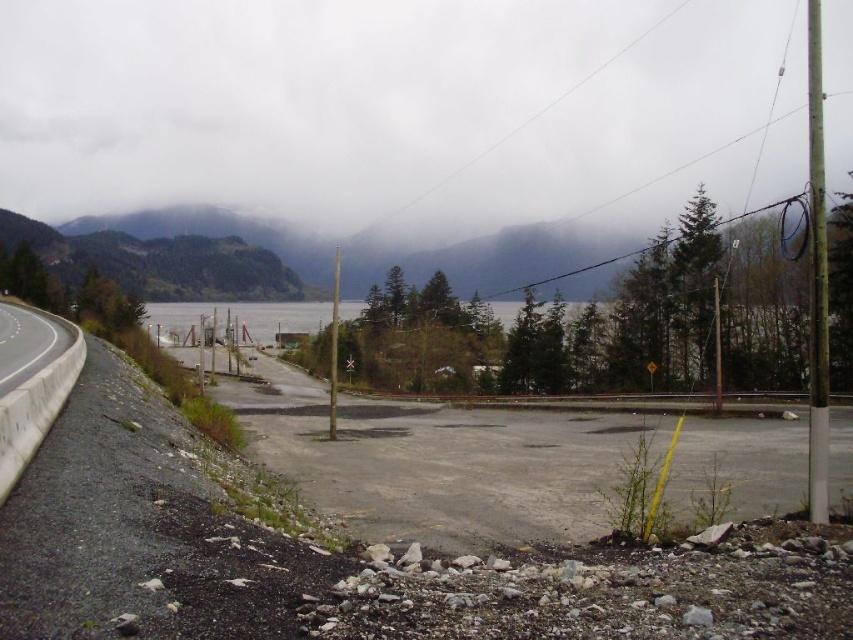
Question: Is cloudy fog at upper center positioned in front of white concrete barrier at left?

Choices:
 (A) no
 (B) yes

Answer: (A)

Question: Which point is closer to the camera?

Choices:
 (A) white concrete barrier at left
 (B) cloudy fog at upper center

Answer: (A)

Question: Is cloudy fog at upper center above white concrete barrier at left?

Choices:
 (A) no
 (B) yes

Answer: (B)

Question: Where is cloudy fog at upper center located in relation to white concrete barrier at left in the image?

Choices:
 (A) below
 (B) above

Answer: (B)

Question: Which of the following is the closest to the observer?

Choices:
 (A) (448, 115)
 (B) (10, 440)

Answer: (B)